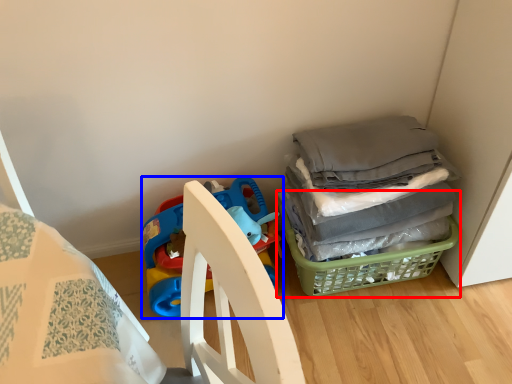
Question: Which object is closer to the camera taking this photo, basket (highlighted by a red box) or toy (highlighted by a blue box)?

Choices:
 (A) basket
 (B) toy

Answer: (B)